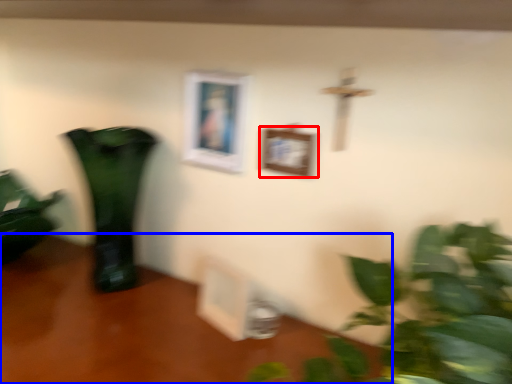
Question: Among these objects, which one is farthest to the camera, picture frame (highlighted by a red box) or table (highlighted by a blue box)?

Choices:
 (A) picture frame
 (B) table

Answer: (A)